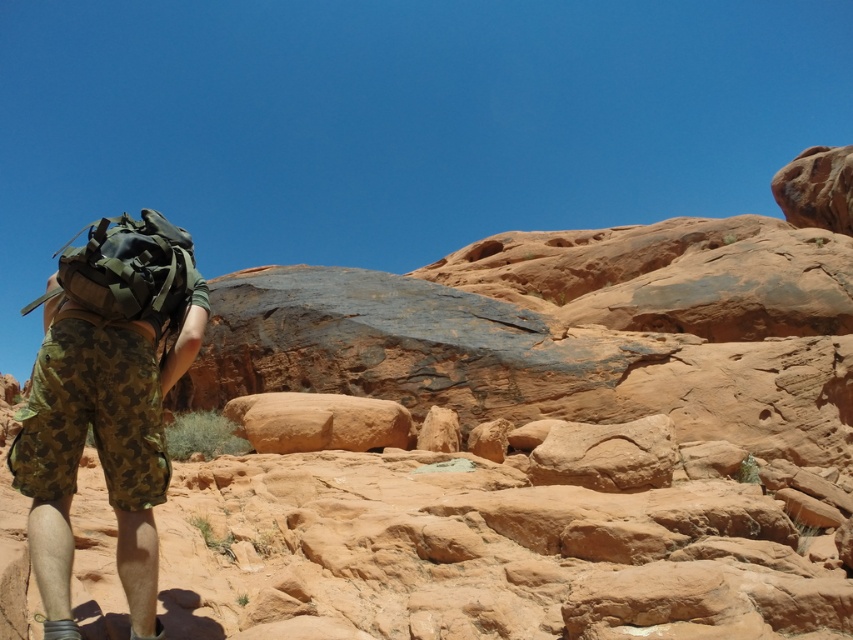
The height and width of the screenshot is (640, 853). I want to click on camo fabric shorts at lower left, so click(x=107, y=401).

Which is in front, point (161, 292) or point (102, 292)?

Point (102, 292)

In order to click on camo fabric shorts at lower left in this screenshot , I will do `click(107, 401)`.